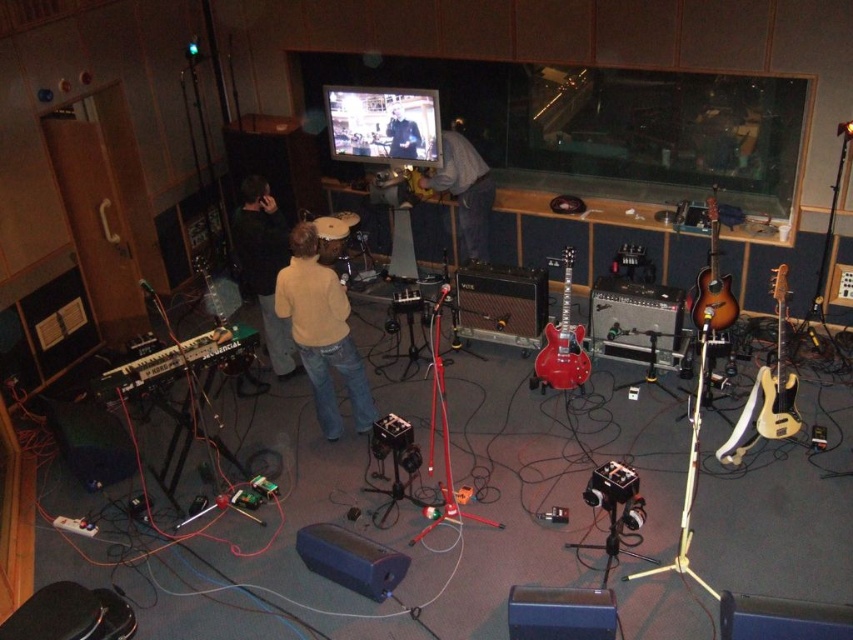
You are standing in a recording studio and want to reach the keyboard on a stand. The studio is cluttered with equipment. There is a point at coordinates point (706, 282) that is 5.45 meters away from you. Can you safely walk from your current position to the keyboard on a stand without stepping on any cables?

The point at point (706, 282) is 5.45 meters away from you. However, the description does not provide information about the location of cables or obstacles between you and the keyboard on a stand. Therefore, it is uncertain if you can safely walk there without stepping on cables.

You are an assistant organizing a music event and need to decide which sweater to use for a promotional photo shoot. Both the dark blue sweater at center and the dark gray sweater at center are available. Which sweater should you choose if you want the one that is bigger in size?

The dark blue sweater at center is larger in size than the dark gray sweater at center, so you should choose the dark blue sweater at center for the promotional photo shoot.

You are a stagehand preparing to move the sunburst wood guitar at right and the dark gray sweater at center. Based on their sizes, which object should you handle with extra care to avoid knocking over nearby equipment?

The sunburst wood guitar at right is taller than the dark gray sweater at center, so you should handle the sunburst wood guitar at right with extra care to avoid knocking over nearby equipment due to its greater height.